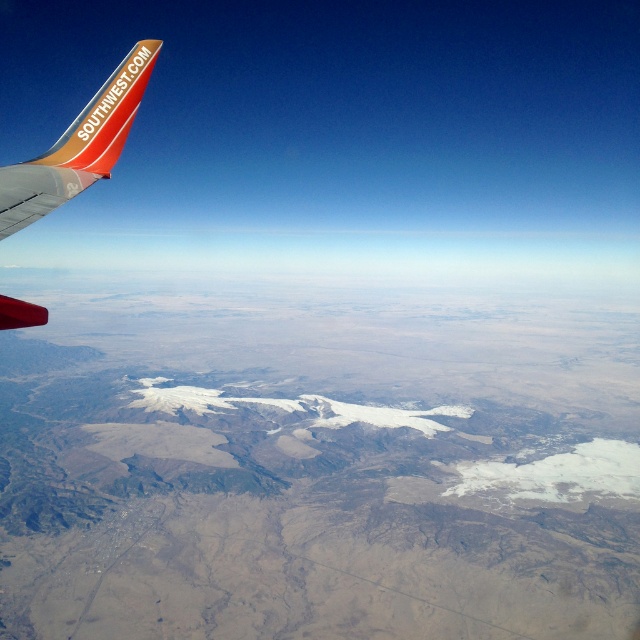
In the scene shown: Who is more distant from viewer, (141, 65) or (58, 152)?

Positioned behind is point (58, 152).

Which is above, matte orange winglet at upper left or orange matte airplane winglet at upper left?

Positioned higher is orange matte airplane winglet at upper left.

Identify the location of matte orange winglet at upper left. (77, 147).